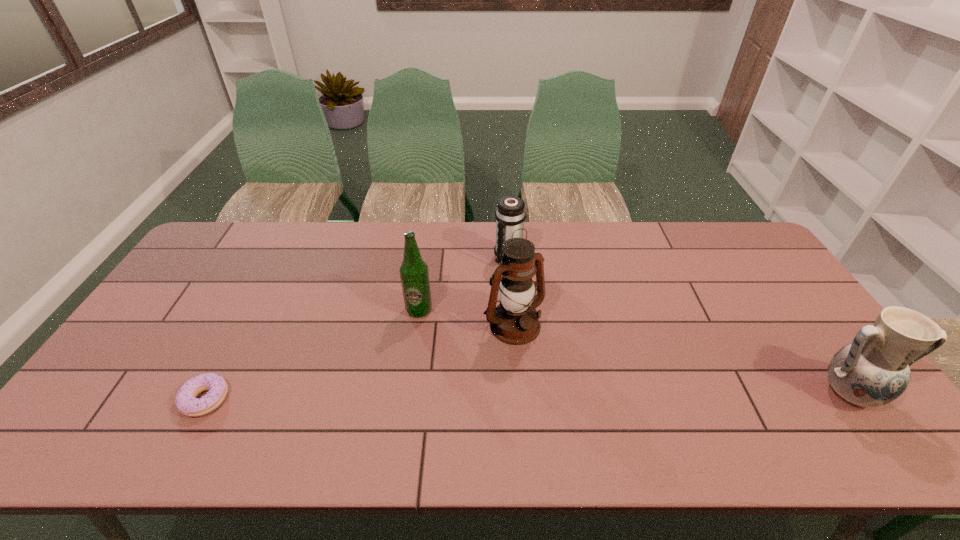
At what (x,y) coordinates should I click in order to perform the action: click on the leftmost object. Please return your answer as a coordinate pair (x, y). Looking at the image, I should click on (186, 402).

Where is `the shortest object`? Image resolution: width=960 pixels, height=540 pixels. the shortest object is located at coordinates pos(186,402).

Locate an element on the screen. The width and height of the screenshot is (960, 540). pottery is located at coordinates (873, 370).

Locate an element on the screen. the farthest object is located at coordinates (510, 215).

The height and width of the screenshot is (540, 960). I want to click on the fourth tallest object, so click(510, 215).

Where is `beer bottle`? The height and width of the screenshot is (540, 960). beer bottle is located at coordinates (414, 274).

I want to click on the tallest object, so click(x=515, y=321).

This screenshot has height=540, width=960. I want to click on free space located 0.060m on the left of the shortest object, so click(x=158, y=400).

This screenshot has height=540, width=960. I want to click on vacant region located 0.250m on the side with the handle of the fourth tallest object, so click(477, 323).

At what (x,y) coordinates should I click in order to perform the action: click on free location located on the side with the handle of the fourth tallest object. Please return your answer as a coordinate pair (x, y). The width and height of the screenshot is (960, 540). Looking at the image, I should click on (488, 302).